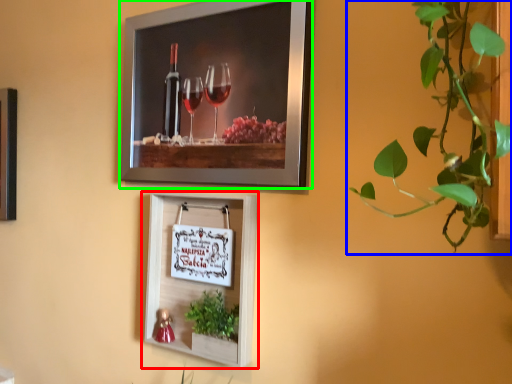
Question: Estimate the real-world distances between objects in this image. Which object is closer to picture frame (highlighted by a red box), houseplant (highlighted by a blue box) or picture frame (highlighted by a green box)?

Choices:
 (A) houseplant
 (B) picture frame

Answer: (B)